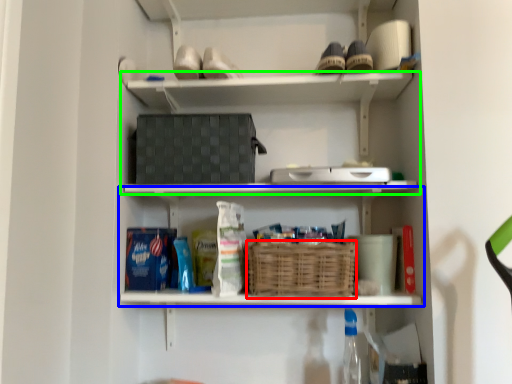
Question: Which is farther away from basket (highlighted by a red box)? shelf (highlighted by a blue box) or shelf (highlighted by a green box)?

Choices:
 (A) shelf
 (B) shelf

Answer: (B)